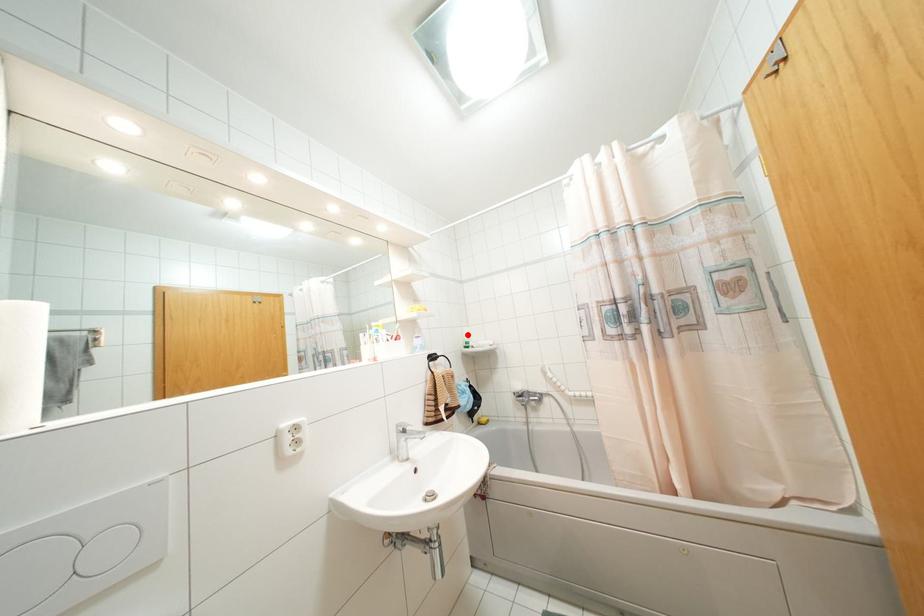
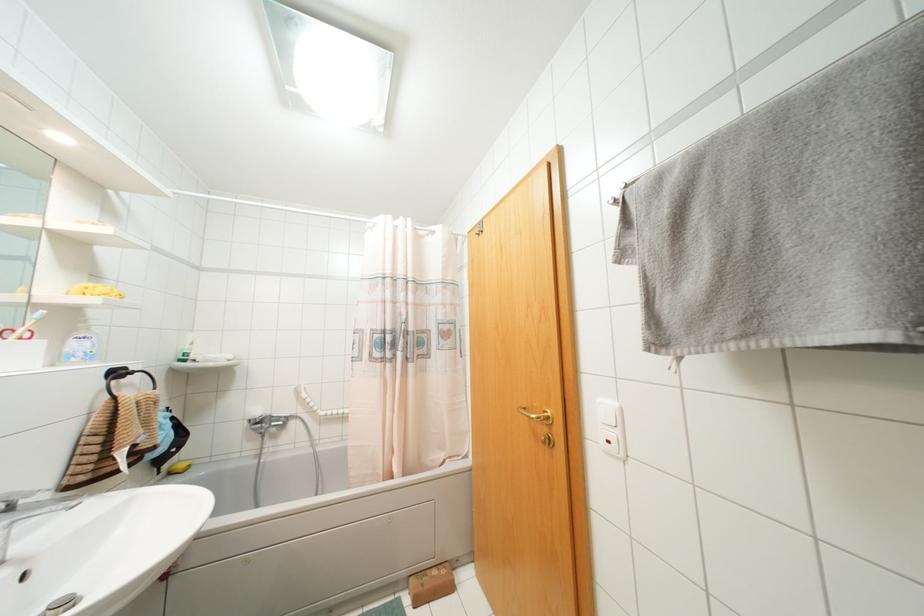
The point at the highlighted location is marked in the first image. Where is the corresponding point in the second image?

(190, 342)